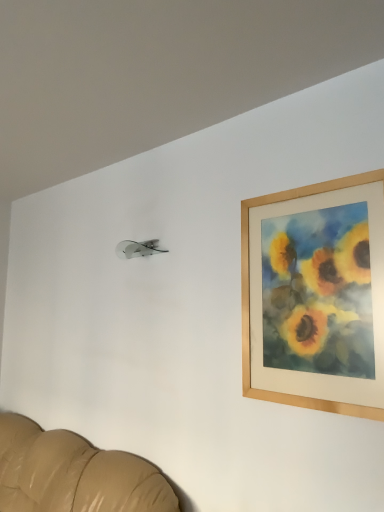
Based on the photo, what is the approximate width of leather couch at lower left?

31.79 inches.

Identify the location of leather couch at lower left. This screenshot has height=512, width=384. (73, 473).

Describe the element at coordinates (73, 473) in the screenshot. I see `leather couch at lower left` at that location.

This screenshot has height=512, width=384. I want to click on wooden picture frame at upper right, so click(x=315, y=296).

Describe the element at coordinates (315, 296) in the screenshot. I see `wooden picture frame at upper right` at that location.

The height and width of the screenshot is (512, 384). Find the location of `leather couch at lower left`. leather couch at lower left is located at coordinates (73, 473).

Between leather couch at lower left and wooden picture frame at upper right, which one appears on the right side from the viewer's perspective?

wooden picture frame at upper right.

Is the depth of leather couch at lower left greater than that of wooden picture frame at upper right?

No.

Which is in front, point (102, 461) or point (360, 267)?

Positioned in front is point (360, 267).

From the image's perspective, which one is positioned lower, leather couch at lower left or wooden picture frame at upper right?

leather couch at lower left, from the image's perspective.

From a real-world perspective, is leather couch at lower left beneath wooden picture frame at upper right?

Correct, in the physical world, leather couch at lower left is lower than wooden picture frame at upper right.

Is leather couch at lower left wider than wooden picture frame at upper right?

Correct, the width of leather couch at lower left exceeds that of wooden picture frame at upper right.

From their relative heights in the image, would you say leather couch at lower left is taller or shorter than wooden picture frame at upper right?

Clearly, leather couch at lower left is shorter compared to wooden picture frame at upper right.

In terms of size, does leather couch at lower left appear bigger or smaller than wooden picture frame at upper right?

Considering their sizes, leather couch at lower left takes up more space than wooden picture frame at upper right.

In the scene shown: Is wooden picture frame at upper right inside leather couch at lower left?

No.

Based on the photo, is leather couch at lower left touching wooden picture frame at upper right?

No, leather couch at lower left is not with wooden picture frame at upper right.

Is leather couch at lower left positioned with its back to wooden picture frame at upper right?

No.

Measure the distance between leather couch at lower left and wooden picture frame at upper right.

leather couch at lower left is 1.22 meters away from wooden picture frame at upper right.

Identify the location of furniture below the wooden picture frame at upper right (from the image's perspective). (73, 473).

Based on their positions, is wooden picture frame at upper right located to the left or right of leather couch at lower left?

In the image, wooden picture frame at upper right appears on the right side of leather couch at lower left.

Consider the image. Is wooden picture frame at upper right positioned in front of leather couch at lower left?

No, wooden picture frame at upper right is further to the viewer.

Between point (351, 186) and point (114, 487), which one is positioned behind?

The point (114, 487) is more distant.

From the image's perspective, which object appears higher, wooden picture frame at upper right or leather couch at lower left?

From the image's view, wooden picture frame at upper right is above.

From a real-world perspective, is wooden picture frame at upper right physically below leather couch at lower left?

No, from a real-world perspective, wooden picture frame at upper right is not under leather couch at lower left.

Is wooden picture frame at upper right wider than leather couch at lower left?

No, wooden picture frame at upper right is not wider than leather couch at lower left.

Considering the sizes of objects wooden picture frame at upper right and leather couch at lower left in the image provided, who is shorter, wooden picture frame at upper right or leather couch at lower left?

With less height is leather couch at lower left.

Who is smaller, wooden picture frame at upper right or leather couch at lower left?

With smaller size is wooden picture frame at upper right.

Is leather couch at lower left located within wooden picture frame at upper right?

Definitely not — leather couch at lower left is not inside wooden picture frame at upper right.

Is wooden picture frame at upper right next to leather couch at lower left?

No, wooden picture frame at upper right is not beside leather couch at lower left.

In the scene shown: Is wooden picture frame at upper right turned away from leather couch at lower left?

No, leather couch at lower left is not at the back of wooden picture frame at upper right.

How different are the orientations of wooden picture frame at upper right and leather couch at lower left in degrees?

1.04 degrees separate the facing orientations of wooden picture frame at upper right and leather couch at lower left.

This screenshot has height=512, width=384. I want to click on furniture on the left of the wooden picture frame at upper right, so click(x=73, y=473).

This screenshot has height=512, width=384. What are the coordinates of `furniture that is under the wooden picture frame at upper right (from a real-world perspective)` in the screenshot? It's located at (73, 473).

The height and width of the screenshot is (512, 384). In order to click on picture frame that is above the leather couch at lower left (from the image's perspective) in this screenshot , I will do `click(315, 296)`.